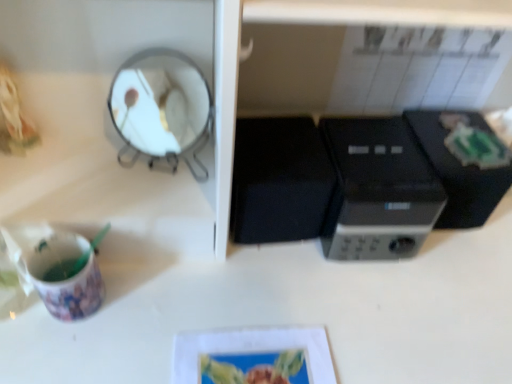
Question: Can we say black plastic microwave at center, the 2th appliance positioned from the left, lies outside black plastic microwave at center?

Choices:
 (A) yes
 (B) no

Answer: (A)

Question: From the image's perspective, does black plastic microwave at center, the 2th appliance positioned from the left, appear higher than black plastic microwave at center?

Choices:
 (A) no
 (B) yes

Answer: (B)

Question: Can you confirm if black plastic microwave at center, the 2th appliance positioned from the left, is bigger than black plastic microwave at center?

Choices:
 (A) no
 (B) yes

Answer: (A)

Question: Would you consider black plastic microwave at center, which is the first appliance in right-to-left order, to be distant from black plastic microwave at center?

Choices:
 (A) no
 (B) yes

Answer: (A)

Question: Is black plastic microwave at center at the back of black plastic microwave at center, which is the first appliance in right-to-left order?

Choices:
 (A) no
 (B) yes

Answer: (A)

Question: Considering the relative sizes of black plastic microwave at center, the 2th appliance positioned from the left, and black plastic microwave at center in the image provided, is black plastic microwave at center, the 2th appliance positioned from the left, smaller than black plastic microwave at center?

Choices:
 (A) yes
 (B) no

Answer: (A)

Question: Is black plastic microwave at center, which is the first appliance in right-to-left order, at the right side of matte plastic cup at lower left?

Choices:
 (A) yes
 (B) no

Answer: (A)

Question: From a real-world perspective, is black plastic microwave at center, which is the first appliance in right-to-left order, beneath matte plastic cup at lower left?

Choices:
 (A) yes
 (B) no

Answer: (B)

Question: Does black plastic microwave at center, the 2th appliance positioned from the left, have a lesser height compared to matte plastic cup at lower left?

Choices:
 (A) no
 (B) yes

Answer: (A)

Question: Is black plastic microwave at center, the 2th appliance positioned from the left, in front of matte plastic cup at lower left?

Choices:
 (A) yes
 (B) no

Answer: (B)

Question: Is black plastic microwave at center, which is the first appliance in right-to-left order, looking in the opposite direction of matte plastic cup at lower left?

Choices:
 (A) yes
 (B) no

Answer: (B)

Question: Does black plastic microwave at center, the 2th appliance positioned from the left, have a smaller size compared to matte plastic cup at lower left?

Choices:
 (A) yes
 (B) no

Answer: (B)

Question: Is black plastic microwave at center, the 2th appliance positioned from the left, completely or partially inside black plastic microwave at center?

Choices:
 (A) yes
 (B) no

Answer: (B)